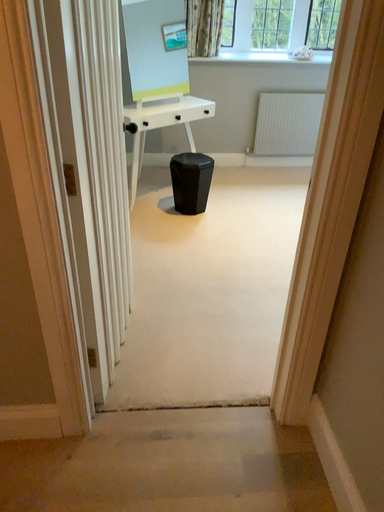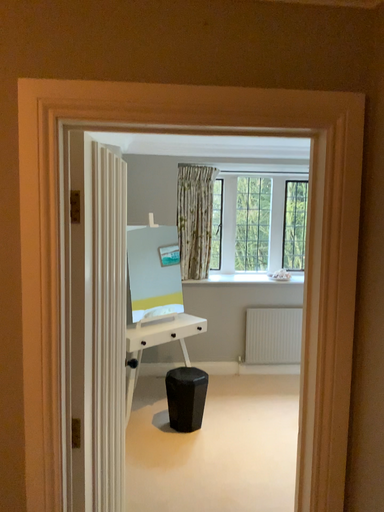
Question: How did the camera likely rotate when shooting the video?

Choices:
 (A) rotated upward
 (B) rotated downward

Answer: (A)